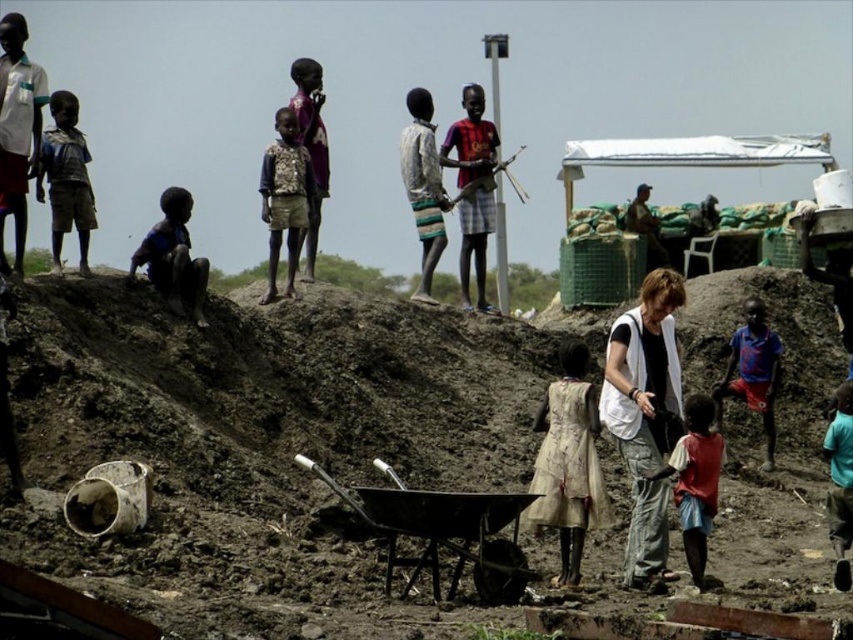
You are a tailor observing the clothing items in the scene. You need to determine which clothing item requires more fabric to make between the brown textured vest at center and the teal fabric shirt at lower right. Which one would you choose?

The brown textured vest at center is bigger than the teal fabric shirt at lower right, so it would require more fabric to make.